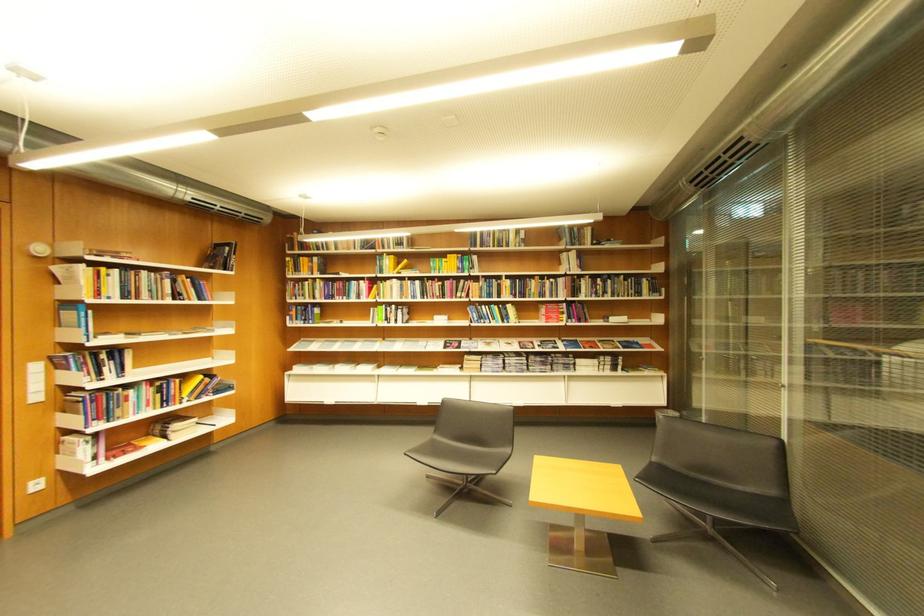
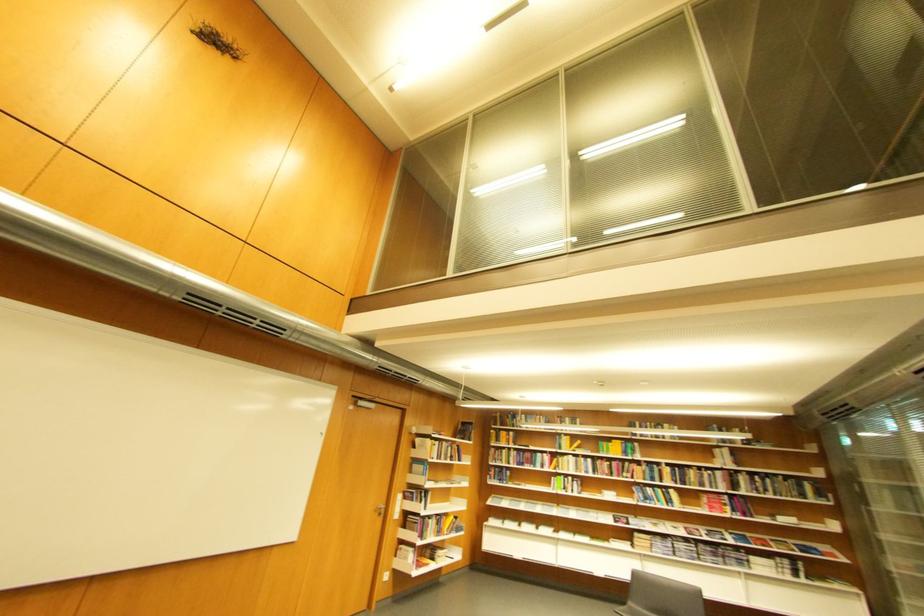
The point at (507, 366) is marked in the first image. Where is the corresponding point in the second image?

(677, 549)